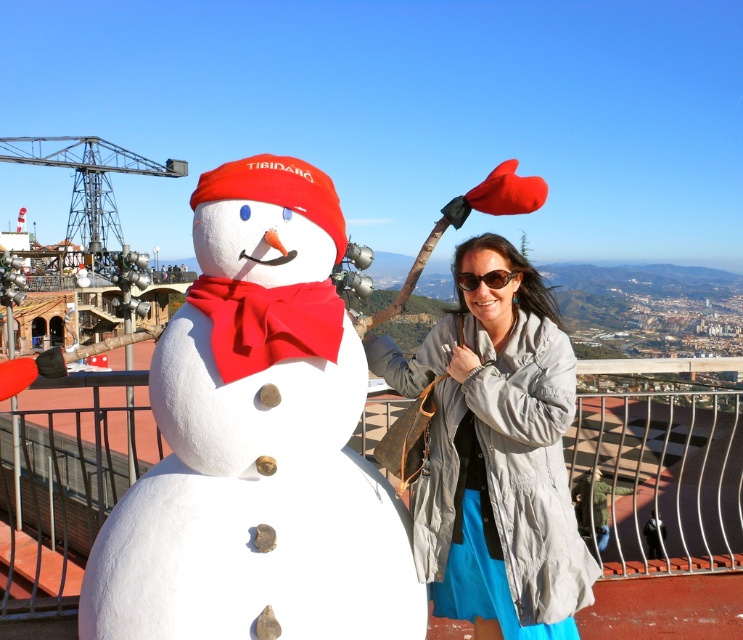
You are a photographer trying to capture the perfect shot of the white matte snowman at center. According to the coordinates provided, where exactly is the snowman located in the image?

The white matte snowman at center is located at coordinates point (256, 442).